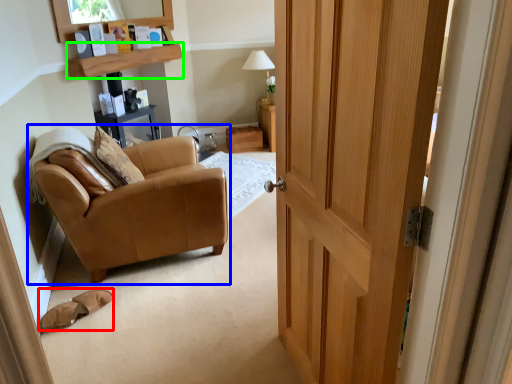
Question: Which is farther away from footwear (highlighted by a red box)? chair (highlighted by a blue box) or shelf (highlighted by a green box)?

Choices:
 (A) chair
 (B) shelf

Answer: (B)